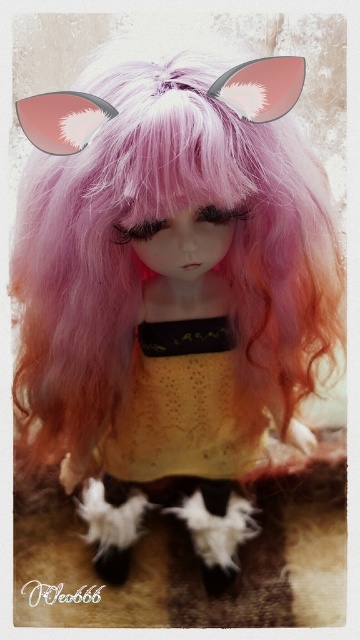
Based on the coordinates provided, where is the yellow lace dress at center located in the image?

The yellow lace dress at center is located at the 2D coordinates point (182,406).

You are a character in a game and need to decide which goggles to wear. The pink matte goggles at upper center and the matte pink goggles at upper left are both available. Which one is covering the other?

The pink matte goggles at upper center is positioned over matte pink goggles at upper left, so it is covering the other.